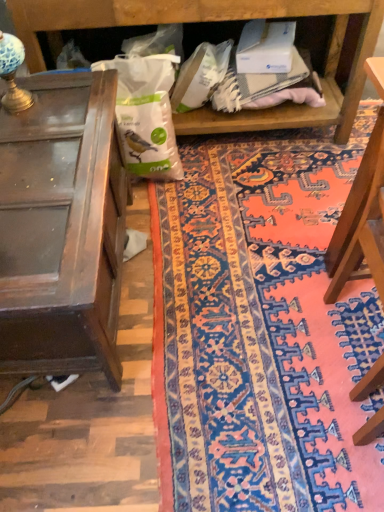
Where is `vacant area that is situated to the right of blue glass lamp at upper left`? The height and width of the screenshot is (512, 384). vacant area that is situated to the right of blue glass lamp at upper left is located at coordinates (65, 98).